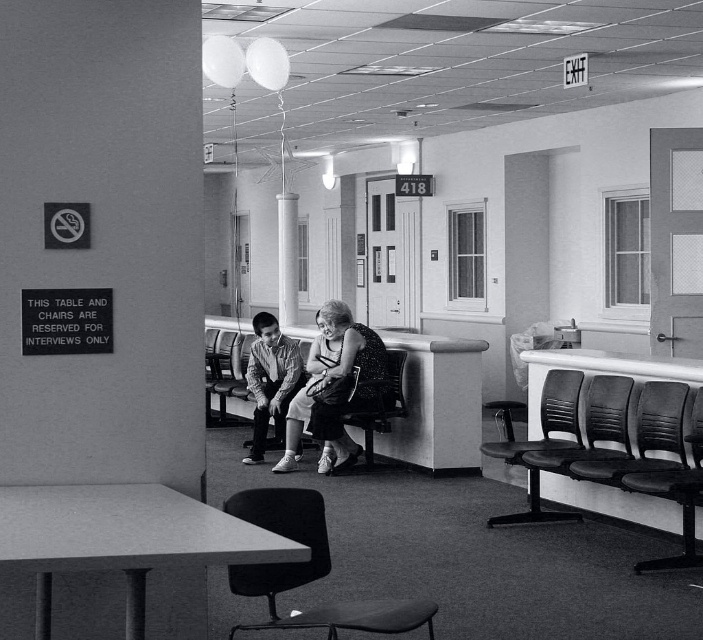
Question: Observing the image, what is the correct spatial positioning of matte black dress at center in reference to black leather chair at lower right?

Choices:
 (A) above
 (B) below

Answer: (A)

Question: Which object is positioned closest to the metallic black bench at center?

Choices:
 (A) striped cotton shirt at center
 (B) metallic gray chair at center
 (C) smooth white column at center
 (D) matte black dress at center

Answer: (D)

Question: Can you confirm if black leather chair at lower right is positioned to the right of metallic gray chair at center?

Choices:
 (A) no
 (B) yes

Answer: (B)

Question: Which point is farther to the camera?

Choices:
 (A) black plastic chair at lower right
 (B) metallic black bench at center

Answer: (B)

Question: Can you confirm if black leather chair at lower right is positioned to the right of metallic gray chair at center?

Choices:
 (A) yes
 (B) no

Answer: (A)

Question: Which object is positioned closest to the striped cotton shirt at center?

Choices:
 (A) smooth black chair at lower center
 (B) black plastic chair at lower right
 (C) metallic gray chair at center
 (D) black leather chair at lower right

Answer: (C)